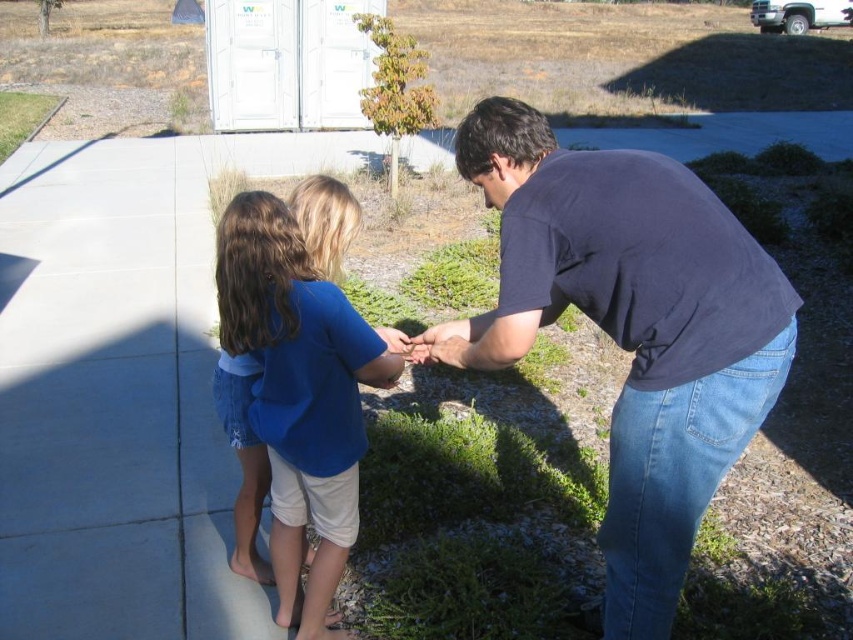
You are standing at the camera position and want to reach the point marked at coordinates (641, 593). If you walk straight ahead, will you reach that point before walking 2 meters?

The point at coordinates (641, 593) is 1.95 meters from the camera, so yes, you will reach it before walking 2 meters.

You are a photographer trying to capture a group photo of the dark blue shirt at center and the blue cotton shirt at center. Which one should you focus on first if you want to ensure the larger person is in focus?

The dark blue shirt at center is bigger than blue cotton shirt at center, so you should focus on the dark blue shirt at center first to ensure the larger person is in focus.

Looking at this image, you are a photographer trying to capture a candid shot of the two people in the scene. Which of the two subjects, the dark blue shirt at center or the blue cotton shirt at center, will appear larger in your photo?

The dark blue shirt at center will appear larger in the photo because it is closer to the viewer than the blue cotton shirt at center.